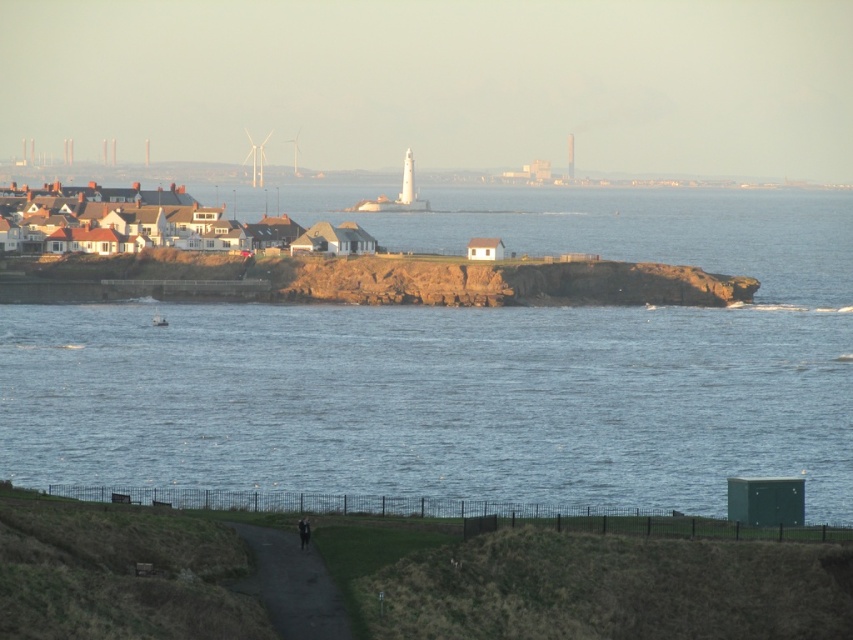
You are standing at the edge of the grassy area and see the blue water at center and the black leather jacket at lower center. Which object is closer to your right side?

The blue water at center is to the right of the black leather jacket at lower center, so it is closer to your right side.

You are a photographer planning to capture the coastal scene. You want to ensure that the blue water at center and the black leather jacket at lower center are both visible in your shot. Given that your camera has a fixed focal length, which object should you prioritize positioning closer to the center of the frame to maintain clarity and detail?

The blue water at center should be prioritized closer to the center of the frame because its width is larger than the black leather jacket at lower center, making it a more dominant element in the scene.

You are planning to build a small boat dock. You need to know which area is larger in the image between the blue water at center and the white matte houses at left. Which one is larger?

The white matte houses at left occupy more space than the blue water at center according to the description, so the white matte houses at left are larger in the image.